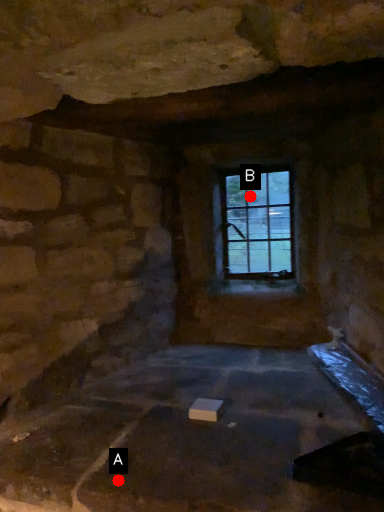
Question: Two points are circled on the image, labeled by A and B beside each circle. Which point is closer to the camera?

Choices:
 (A) A is closer
 (B) B is closer

Answer: (A)